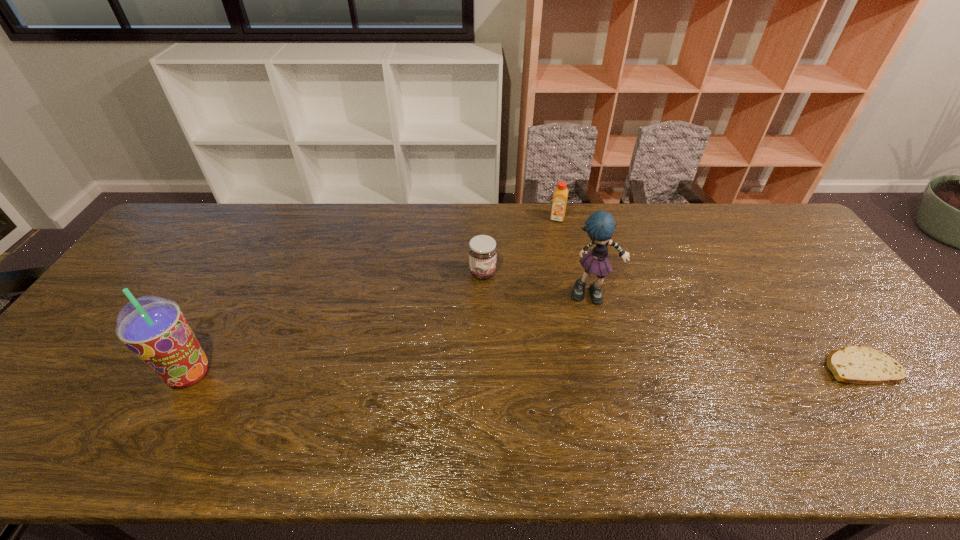
Image resolution: width=960 pixels, height=540 pixels. In order to click on free space that is in between the rag doll and the leftmost object in this screenshot , I will do `click(391, 334)`.

This screenshot has height=540, width=960. I want to click on empty location between the rag doll and the second farthest object, so click(538, 284).

This screenshot has width=960, height=540. What are the coordinates of `free space between the orange juice and the smoothie` in the screenshot? It's located at (373, 296).

This screenshot has width=960, height=540. I want to click on vacant space that's between the leftmost object and the third shortest object, so click(373, 296).

Locate an element on the screen. The width and height of the screenshot is (960, 540). free space between the rightmost object and the leftmost object is located at coordinates (524, 370).

Image resolution: width=960 pixels, height=540 pixels. I want to click on free spot between the orange juice and the third farthest object, so click(x=575, y=256).

Where is `vacant space that is in between the farthest object and the third farthest object`? Image resolution: width=960 pixels, height=540 pixels. vacant space that is in between the farthest object and the third farthest object is located at coordinates (575, 256).

The width and height of the screenshot is (960, 540). Identify the location of object that can be found as the second closest to the rag doll. (560, 195).

The height and width of the screenshot is (540, 960). What are the coordinates of `object that is the third closest to the orange juice` in the screenshot? It's located at (853, 364).

Find the location of a particular element. vacant space that satisfies the following two spatial constraints: 1. on the front side of the third shortest object; 2. on the left side of the pita bread is located at coordinates (588, 366).